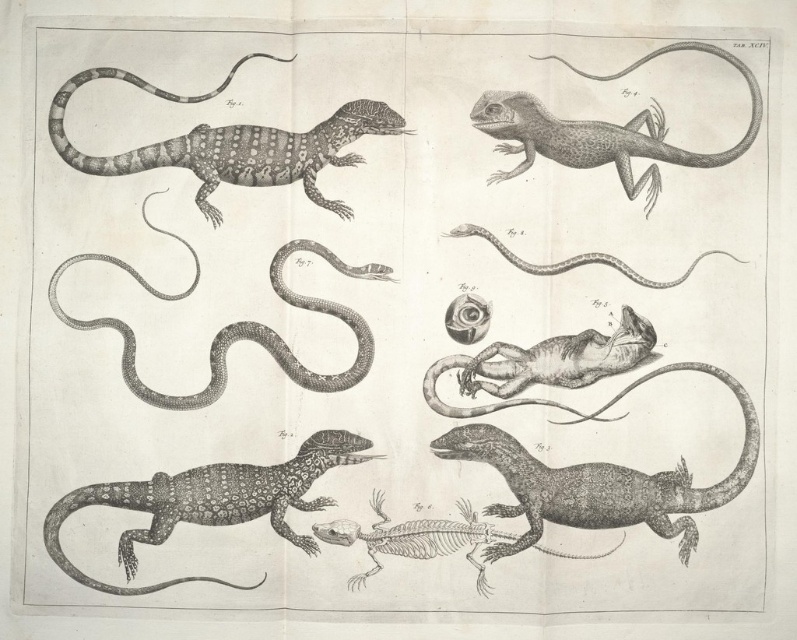
Based on the scene description, where is the speckled patterned lizard at upper left located in the image?

The speckled patterned lizard at upper left is located at the 2D coordinates point (232, 144) in the image.

Looking at the scientific illustration, you need to identify the spatial relationship between the smooth gray lizard at lower right and the speckled patterned lizard at upper left. Which lizard is positioned to the right of the other?

The smooth gray lizard at lower right is positioned to the right of the speckled patterned lizard at upper left.